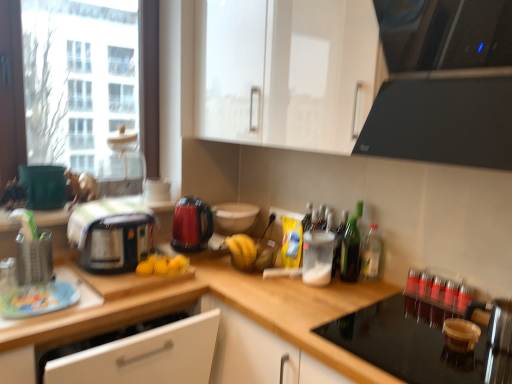
Question: From a real-world perspective, is black plastic toaster at left, the second kitchen appliance in the right-to-left sequence, below white glossy cabinet at upper center?

Choices:
 (A) no
 (B) yes

Answer: (B)

Question: Does black plastic toaster at left, the second kitchen appliance in the right-to-left sequence, have a lesser width compared to white glossy cabinet at upper center?

Choices:
 (A) yes
 (B) no

Answer: (A)

Question: Would you say black plastic toaster at left, the first kitchen appliance viewed from the left, is outside white glossy cabinet at upper center?

Choices:
 (A) no
 (B) yes

Answer: (B)

Question: Does black plastic toaster at left, the first kitchen appliance viewed from the left, have a smaller size compared to white glossy cabinet at upper center?

Choices:
 (A) yes
 (B) no

Answer: (A)

Question: From the image's perspective, would you say black plastic toaster at left, the first kitchen appliance viewed from the left, is positioned over white glossy cabinet at upper center?

Choices:
 (A) yes
 (B) no

Answer: (B)

Question: Is point (378, 261) positioned closer to the camera than point (23, 241)?

Choices:
 (A) closer
 (B) farther

Answer: (B)

Question: From a real-world perspective, is clear glass bottle at right, acting as the second bottle starting from the right, above or below metallic silver utensil holder at left, the second appliance viewed from the left?

Choices:
 (A) below
 (B) above

Answer: (A)

Question: From the image's perspective, is clear glass bottle at right, acting as the second bottle starting from the right, above or below metallic silver utensil holder at left, marked as the 4th appliance in a right-to-left arrangement?

Choices:
 (A) below
 (B) above

Answer: (A)

Question: Is clear glass bottle at right, the second bottle from the left, taller or shorter than metallic silver utensil holder at left, the second appliance viewed from the left?

Choices:
 (A) tall
 (B) short

Answer: (B)

Question: Looking at the image, does red glass bottles at right, marked as the 3th bottle in a left-to-right arrangement, seem bigger or smaller compared to metallic silver utensil holder at left, the second appliance viewed from the left?

Choices:
 (A) small
 (B) big

Answer: (A)

Question: In terms of height, does red glass bottles at right, marked as the 3th bottle in a left-to-right arrangement, look taller or shorter compared to metallic silver utensil holder at left, the second appliance viewed from the left?

Choices:
 (A) short
 (B) tall

Answer: (A)

Question: From the image's perspective, is red glass bottles at right, positioned as the 1th bottle in right-to-left order, above or below metallic silver utensil holder at left, marked as the 4th appliance in a right-to-left arrangement?

Choices:
 (A) above
 (B) below

Answer: (B)

Question: Considering the relative positions of red glass bottles at right, marked as the 3th bottle in a left-to-right arrangement, and metallic silver utensil holder at left, the second appliance viewed from the left, in the image provided, is red glass bottles at right, marked as the 3th bottle in a left-to-right arrangement, to the left or to the right of metallic silver utensil holder at left, the second appliance viewed from the left,?

Choices:
 (A) left
 (B) right

Answer: (B)

Question: In the image, is black glass cooktop at upper right positioned in front of or behind black glass stovetop at lower right, which is the first appliance from right to left?

Choices:
 (A) front
 (B) behind

Answer: (A)

Question: Is point (446, 107) positioned closer to the camera than point (381, 309)?

Choices:
 (A) farther
 (B) closer

Answer: (B)